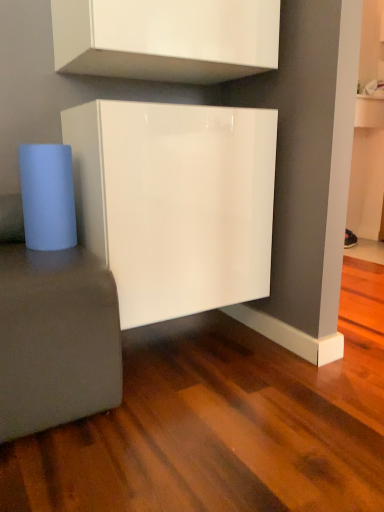
Question: Should I look upward or downward to see glossy white cabinet at center, which is the 1th cabinetry from bottom to top?

Choices:
 (A) down
 (B) up

Answer: (B)

Question: Is the position of matte gray side table at lower left less distant than that of glossy white cabinet at center, the second cabinetry in the top-to-bottom sequence?

Choices:
 (A) yes
 (B) no

Answer: (A)

Question: Considering the relative sizes of matte gray side table at lower left and glossy white cabinet at center, the second cabinetry in the top-to-bottom sequence, in the image provided, is matte gray side table at lower left thinner than glossy white cabinet at center, the second cabinetry in the top-to-bottom sequence,?

Choices:
 (A) no
 (B) yes

Answer: (A)

Question: Is matte gray side table at lower left at the right side of glossy white cabinet at center, the second cabinetry in the top-to-bottom sequence?

Choices:
 (A) yes
 (B) no

Answer: (B)

Question: From the image's perspective, is matte gray side table at lower left below glossy white cabinet at center, the second cabinetry in the top-to-bottom sequence?

Choices:
 (A) no
 (B) yes

Answer: (B)

Question: Does matte gray side table at lower left touch glossy white cabinet at center, which is the 1th cabinetry from bottom to top?

Choices:
 (A) no
 (B) yes

Answer: (A)

Question: Is matte gray side table at lower left bigger than glossy white cabinet at center, which is the 1th cabinetry from bottom to top?

Choices:
 (A) no
 (B) yes

Answer: (A)

Question: Does glossy white cabinet at center, which is the 1th cabinetry from bottom to top, turn towards matte gray side table at lower left?

Choices:
 (A) yes
 (B) no

Answer: (B)

Question: Is glossy white cabinet at center, the second cabinetry in the top-to-bottom sequence, taller than matte gray side table at lower left?

Choices:
 (A) no
 (B) yes

Answer: (B)

Question: Considering the relative positions of glossy white cabinet at center, the second cabinetry in the top-to-bottom sequence, and matte gray side table at lower left in the image provided, is glossy white cabinet at center, the second cabinetry in the top-to-bottom sequence, to the left of matte gray side table at lower left from the viewer's perspective?

Choices:
 (A) yes
 (B) no

Answer: (B)

Question: From the image's perspective, is glossy white cabinet at center, the second cabinetry in the top-to-bottom sequence, below matte gray side table at lower left?

Choices:
 (A) no
 (B) yes

Answer: (A)

Question: Can you confirm if glossy white cabinet at center, which is the 1th cabinetry from bottom to top, is thinner than matte gray side table at lower left?

Choices:
 (A) yes
 (B) no

Answer: (A)

Question: From a real-world perspective, does glossy white cabinet at center, the second cabinetry in the top-to-bottom sequence, sit lower than matte gray side table at lower left?

Choices:
 (A) yes
 (B) no

Answer: (B)

Question: Is glossy white cabinet at center, the second cabinetry in the top-to-bottom sequence, positioned far away from glossy white cabinet at upper center, which appears as the 2th cabinetry when ordered from the bottom?

Choices:
 (A) yes
 (B) no

Answer: (B)